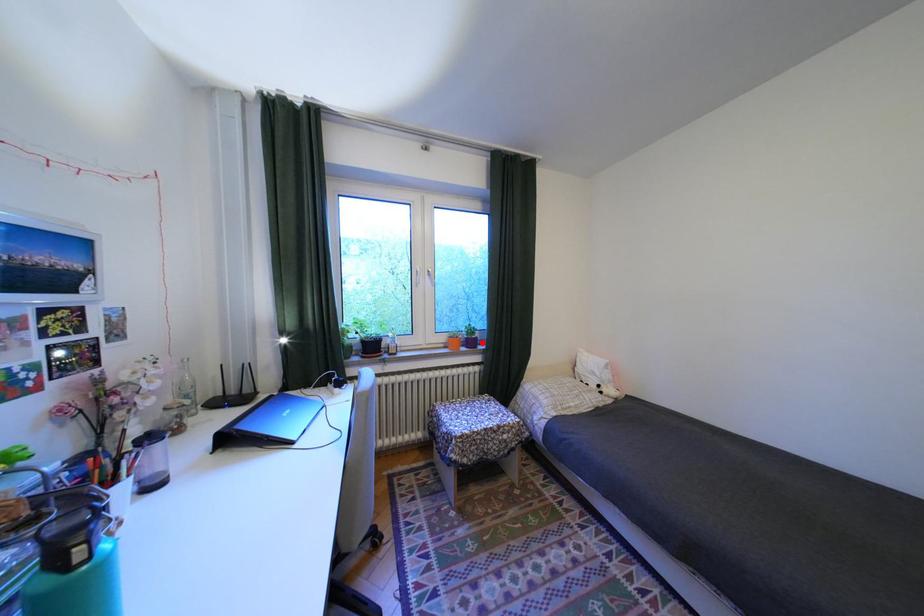
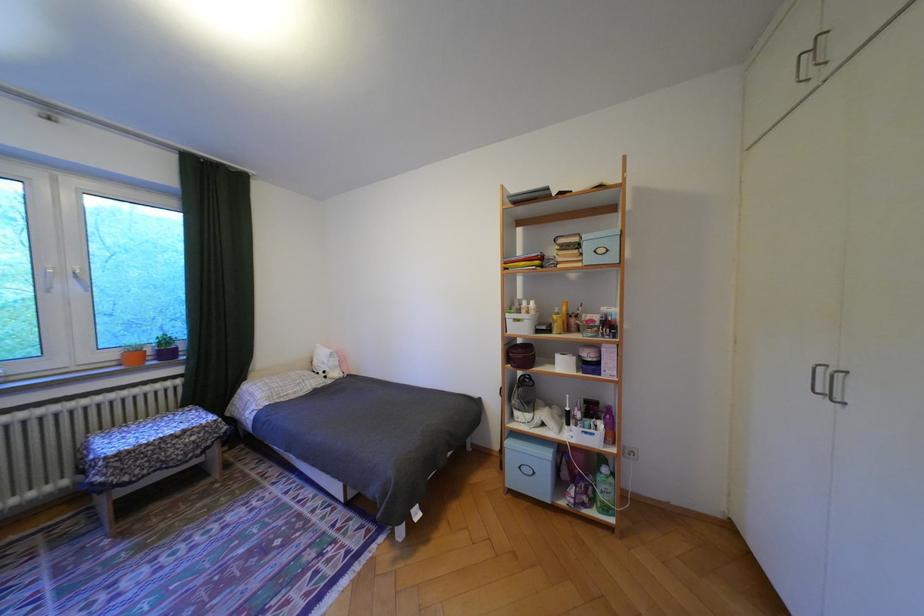
Locate, in the second image, the point that corresponds to the highlighted location in the first image.

(178, 354)